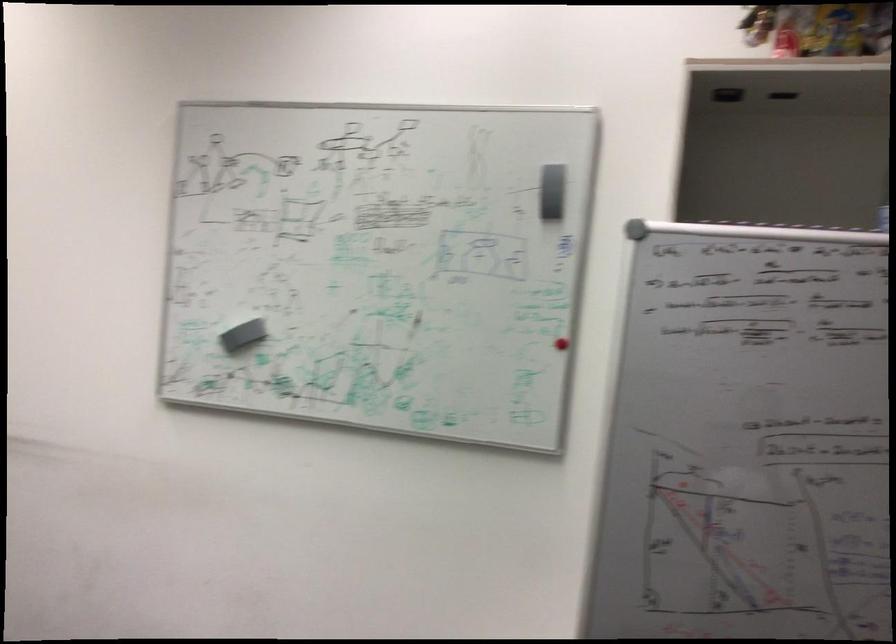
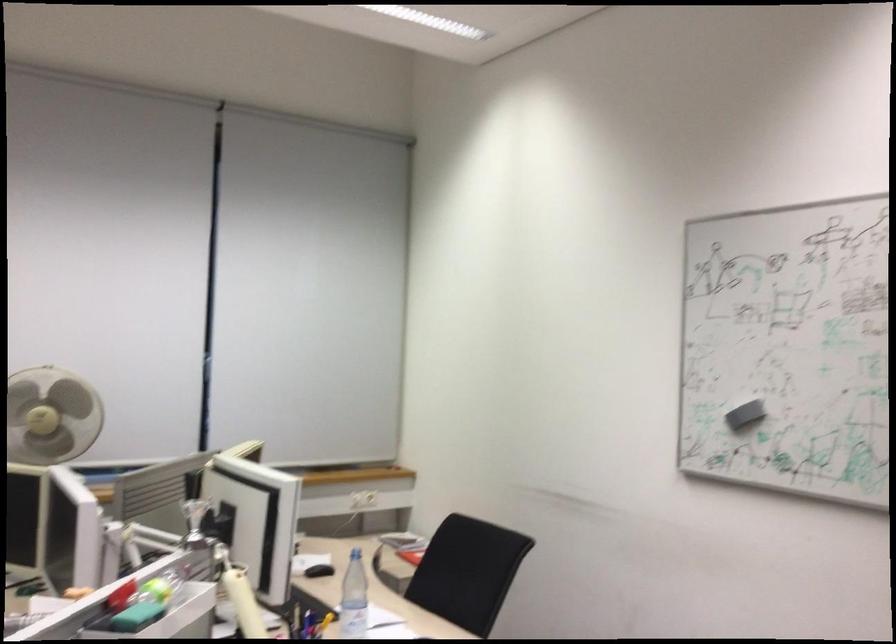
Question: Based on the continuous images, in which direction is the camera rotating? Reply with the corresponding letter.

Choices:
 (A) Left
 (B) Right
 (C) Up
 (D) Down

Answer: (A)